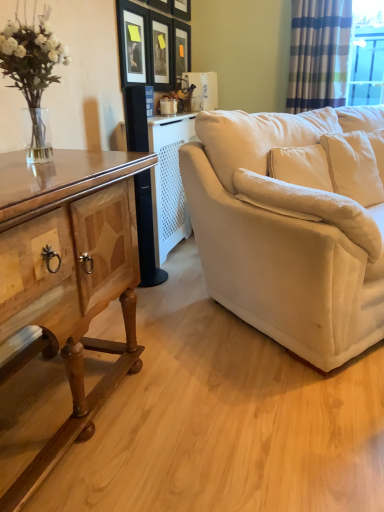
What is the approximate width of matte black picture frame at upper center, marked as the 1th picture frame in a left-to-right arrangement?

It is 1.56 inches.

The width and height of the screenshot is (384, 512). Find the location of `striped fabric curtain at upper right`. striped fabric curtain at upper right is located at coordinates coord(318,54).

You are a GUI agent. You are given a task and a screenshot of the screen. Output one action in this format:
    pyautogui.click(x=<x>, y=<y>)
    Task: Click on the matte black picture frame at upper center, the second picture frame viewed from the left
    The width and height of the screenshot is (384, 512).
    Given the screenshot: What is the action you would take?
    pyautogui.click(x=161, y=51)

The height and width of the screenshot is (512, 384). I want to click on white soft cushion at right, so click(x=311, y=207).

Find the location of a particular element. The image size is (384, 512). matte black picture frame at upper center, the fourth picture frame positioned from the right is located at coordinates (132, 42).

Where is `curtain on the right of wooden picture frame at upper center, placed as the first picture frame when sorted from right to left`? curtain on the right of wooden picture frame at upper center, placed as the first picture frame when sorted from right to left is located at coordinates (318, 54).

Is the depth of striped fabric curtain at upper right greater than that of wooden picture frame at upper center, positioned as the 4th picture frame in left-to-right order?

That is False.

Is striped fabric curtain at upper right inside the boundaries of wooden picture frame at upper center, placed as the first picture frame when sorted from right to left, or outside?

striped fabric curtain at upper right is outside wooden picture frame at upper center, placed as the first picture frame when sorted from right to left.

Can you confirm if striped fabric curtain at upper right is positioned to the right of white soft cushion at right?

Indeed, striped fabric curtain at upper right is positioned on the right side of white soft cushion at right.

Choose the correct answer: Is striped fabric curtain at upper right inside white soft cushion at right or outside it?

striped fabric curtain at upper right is outside white soft cushion at right.

From the image's perspective, which is above, striped fabric curtain at upper right or white soft cushion at right?

striped fabric curtain at upper right appears higher in the image.

Can you confirm if striped fabric curtain at upper right is shorter than white soft cushion at right?

No, striped fabric curtain at upper right is not shorter than white soft cushion at right.

Considering the relative sizes of white soft cushion at right and matte black picture frame at upper center, the fourth picture frame positioned from the right, in the image provided, is white soft cushion at right taller than matte black picture frame at upper center, the fourth picture frame positioned from the right,?

No, white soft cushion at right is not taller than matte black picture frame at upper center, the fourth picture frame positioned from the right.

From a real-world perspective, does white soft cushion at right sit lower than matte black picture frame at upper center, the fourth picture frame positioned from the right?

Correct, in the physical world, white soft cushion at right is lower than matte black picture frame at upper center, the fourth picture frame positioned from the right.

Would you say white soft cushion at right is a long distance from matte black picture frame at upper center, marked as the 1th picture frame in a left-to-right arrangement?

Yes, white soft cushion at right and matte black picture frame at upper center, marked as the 1th picture frame in a left-to-right arrangement, are quite far apart.

Is white soft cushion at right positioned behind matte black picture frame at upper center, marked as the 1th picture frame in a left-to-right arrangement?

No, it is not.

Looking at this image, can you confirm if matte black picture frame at upper center, which appears as the second picture frame when viewed from the right, is positioned to the left of striped fabric curtain at upper right?

Correct, you'll find matte black picture frame at upper center, which appears as the second picture frame when viewed from the right, to the left of striped fabric curtain at upper right.

Would you consider matte black picture frame at upper center, acting as the 3th picture frame starting from the left, to be distant from striped fabric curtain at upper right?

No, matte black picture frame at upper center, acting as the 3th picture frame starting from the left, is not far away from striped fabric curtain at upper right.

Is point (190, 6) closer or farther from the camera than point (321, 25)?

Point (190, 6) appears to be farther away from the viewer than point (321, 25).

From the image's perspective, which one is positioned lower, white soft cushion at right or wooden cabinet at left?

wooden cabinet at left appears lower in the image.

Considering the relative sizes of white soft cushion at right and wooden cabinet at left in the image provided, is white soft cushion at right thinner than wooden cabinet at left?

Indeed, white soft cushion at right has a lesser width compared to wooden cabinet at left.

Is white soft cushion at right bigger than wooden cabinet at left?

No.

How different are the orientations of white soft cushion at right and wooden cabinet at left in degrees?

white soft cushion at right and wooden cabinet at left are facing 53.2 degrees away from each other.

Image resolution: width=384 pixels, height=512 pixels. I want to click on studio couch below the wooden picture frame at upper center, positioned as the 4th picture frame in left-to-right order (from the image's perspective), so click(293, 227).

Is velvet beige couch at right with wooden picture frame at upper center, placed as the first picture frame when sorted from right to left?

velvet beige couch at right is not next to wooden picture frame at upper center, placed as the first picture frame when sorted from right to left, and they're not touching.

Does velvet beige couch at right have a greater width compared to wooden picture frame at upper center, positioned as the 4th picture frame in left-to-right order?

Correct, the width of velvet beige couch at right exceeds that of wooden picture frame at upper center, positioned as the 4th picture frame in left-to-right order.

Could you tell me if white glossy coffee cup at center is turned towards matte black picture frame at upper center, acting as the 3th picture frame starting from the left?

No, white glossy coffee cup at center is not turned towards matte black picture frame at upper center, acting as the 3th picture frame starting from the left.

In the scene shown: How many degrees apart are the facing directions of white glossy coffee cup at center and matte black picture frame at upper center, which appears as the second picture frame when viewed from the right?

The angle between the facing direction of white glossy coffee cup at center and the facing direction of matte black picture frame at upper center, which appears as the second picture frame when viewed from the right, is 3.71 degrees.

The image size is (384, 512). Find the location of `coffee cup on the left of matte black picture frame at upper center, which appears as the second picture frame when viewed from the right`. coffee cup on the left of matte black picture frame at upper center, which appears as the second picture frame when viewed from the right is located at coordinates (168, 106).

Based on the photo, is white glossy coffee cup at center bigger or smaller than matte black picture frame at upper center, acting as the 3th picture frame starting from the left?

Considering their sizes, white glossy coffee cup at center takes up less space than matte black picture frame at upper center, acting as the 3th picture frame starting from the left.

Where is `curtain in front of the wooden picture frame at upper center, positioned as the 4th picture frame in left-to-right order`? The height and width of the screenshot is (512, 384). curtain in front of the wooden picture frame at upper center, positioned as the 4th picture frame in left-to-right order is located at coordinates (318, 54).

You are a GUI agent. You are given a task and a screenshot of the screen. Output one action in this format:
    pyautogui.click(x=<x>, y=<y>)
    Task: Click on the pillow on the left of striped fabric curtain at upper right
    
    Given the screenshot: What is the action you would take?
    pyautogui.click(x=311, y=207)

When comparing their distances from velvet beige couch at right, does matte black picture frame at upper center, the second picture frame viewed from the left, or wooden cabinet at left seem closer?

Among the two, wooden cabinet at left is located nearer to velvet beige couch at right.

Estimate the real-world distances between objects in this image. Which object is further from velvet beige couch at right, matte black picture frame at upper center, acting as the 3th picture frame starting from the left, or wooden cabinet at left?

matte black picture frame at upper center, acting as the 3th picture frame starting from the left, is positioned further to the anchor velvet beige couch at right.

Which object lies further to the anchor point matte black picture frame at upper center, marked as the 1th picture frame in a left-to-right arrangement, striped fabric curtain at upper right or matte black picture frame at upper center, which appears as the second picture frame when viewed from the right?

striped fabric curtain at upper right.

When comparing their distances from velvet beige couch at right, does matte black picture frame at upper center, the fourth picture frame positioned from the right, or white soft cushion at right seem further?

matte black picture frame at upper center, the fourth picture frame positioned from the right, is further to velvet beige couch at right.

Looking at the image, which one is located further to matte black picture frame at upper center, marked as the 1th picture frame in a left-to-right arrangement, velvet beige couch at right or matte black picture frame at upper center, acting as the 3th picture frame starting from the left?

The object further to matte black picture frame at upper center, marked as the 1th picture frame in a left-to-right arrangement, is velvet beige couch at right.

Looking at the image, which one is located further to velvet beige couch at right, matte black picture frame at upper center, marked as the 1th picture frame in a left-to-right arrangement, or striped fabric curtain at upper right?

The object further to velvet beige couch at right is striped fabric curtain at upper right.

Estimate the real-world distances between objects in this image. Which object is further from matte black picture frame at upper center, which is the third picture frame in right-to-left order, wooden cabinet at left or wooden picture frame at upper center, placed as the first picture frame when sorted from right to left?

Among the two, wooden cabinet at left is located further to matte black picture frame at upper center, which is the third picture frame in right-to-left order.

Considering their positions, is white glossy coffee cup at center positioned further to white soft cushion at right than wooden cabinet at left?

white glossy coffee cup at center.

This screenshot has height=512, width=384. Find the location of `studio couch between matte black picture frame at upper center, acting as the 3th picture frame starting from the left, and wooden cabinet at left in the up-down direction`. studio couch between matte black picture frame at upper center, acting as the 3th picture frame starting from the left, and wooden cabinet at left in the up-down direction is located at coordinates (293, 227).

In order to click on coffee cup located between velvet beige couch at right and matte black picture frame at upper center, acting as the 3th picture frame starting from the left, in the depth direction in this screenshot , I will do `click(168, 106)`.

Identify the location of curtain between velvet beige couch at right and wooden picture frame at upper center, positioned as the 4th picture frame in left-to-right order, in the front-back direction. (318, 54).

You are a GUI agent. You are given a task and a screenshot of the screen. Output one action in this format:
    pyautogui.click(x=<x>, y=<y>)
    Task: Click on the pillow between matte black picture frame at upper center, acting as the 3th picture frame starting from the left, and wooden cabinet at left vertically
    Image resolution: width=384 pixels, height=512 pixels.
    Given the screenshot: What is the action you would take?
    pyautogui.click(x=311, y=207)